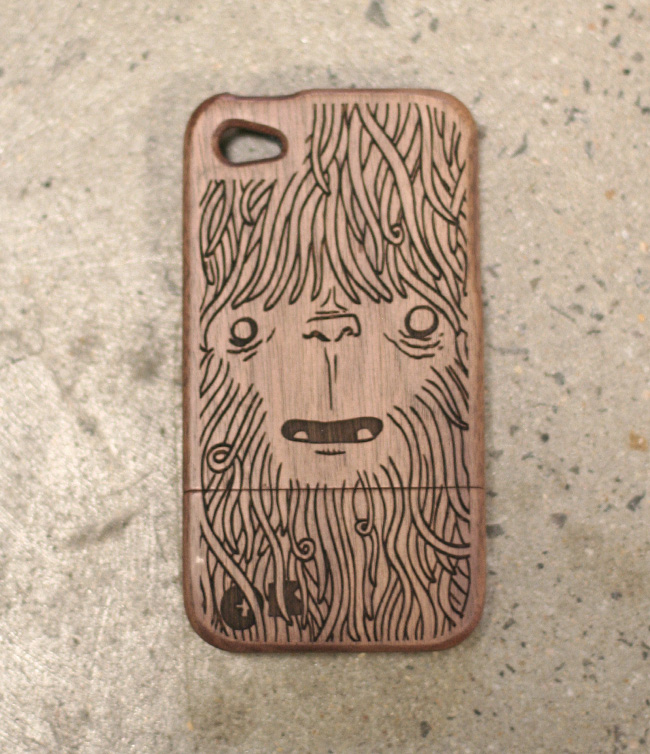
The image size is (650, 754). Identify the location of tabletop. (84, 578).